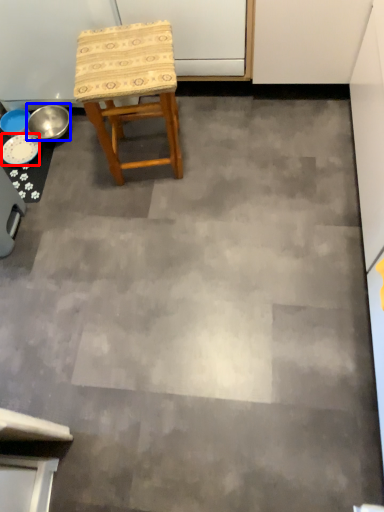
Question: Which of the following is the closest to the observer, plate (highlighted by a red box) or bowl (highlighted by a blue box)?

Choices:
 (A) plate
 (B) bowl

Answer: (A)